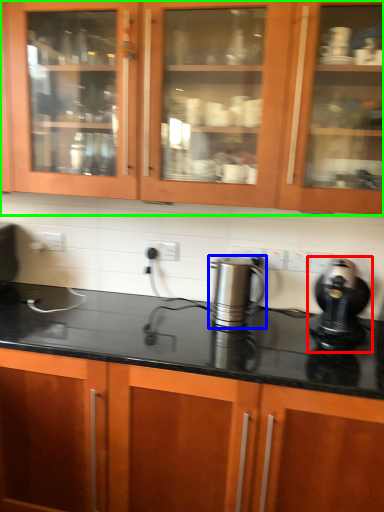
Question: Which object is the farthest from home appliance (highlighted by a red box)? Choose among these: kitchen appliance (highlighted by a blue box) or cabinetry (highlighted by a green box).

Choices:
 (A) kitchen appliance
 (B) cabinetry

Answer: (B)